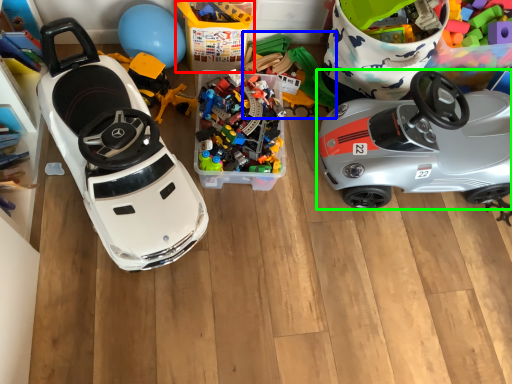
Question: Based on their relative distances, which object is farther from storage box (highlighted by a red box)? Choose from toy (highlighted by a blue box) and car (highlighted by a green box).

Choices:
 (A) toy
 (B) car

Answer: (B)